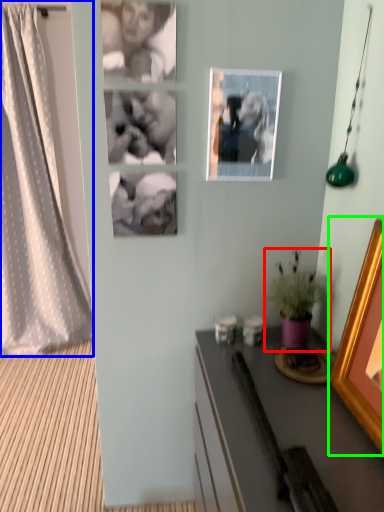
Question: Which is farther away from houseplant (highlighted by a red box)? curtain (highlighted by a blue box) or picture frame (highlighted by a green box)?

Choices:
 (A) curtain
 (B) picture frame

Answer: (A)